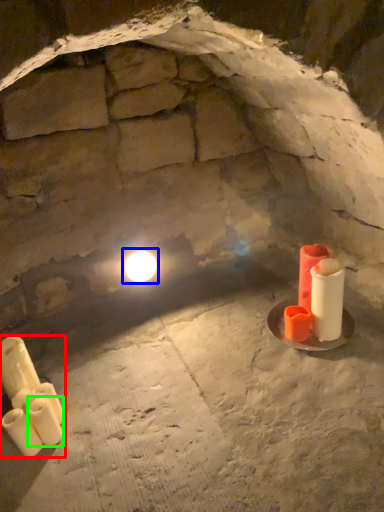
Question: Estimate the real-world distances between objects in this image. Which object is farther from candle (highlighted by a red box), light (highlighted by a blue box) or candle (highlighted by a green box)?

Choices:
 (A) light
 (B) candle

Answer: (A)